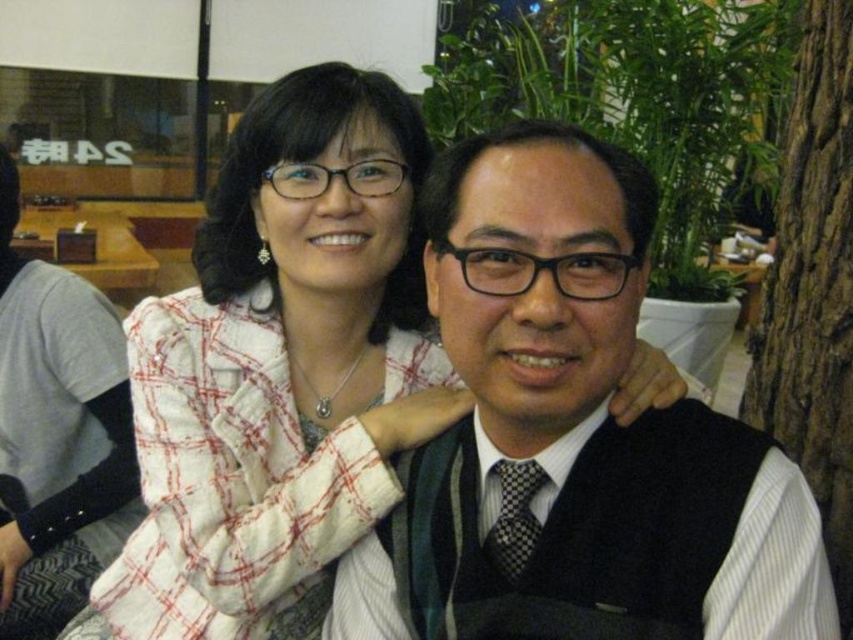
Question: Observing the image, what is the correct spatial positioning of white checkered jacket at upper center in reference to brown rough bark at right?

Choices:
 (A) above
 (B) below

Answer: (B)

Question: Estimate the real-world distances between objects in this image. Which object is closer to the matte black vest at center?

Choices:
 (A) white checkered jacket at upper center
 (B) brown rough bark at right

Answer: (A)

Question: Can you confirm if white checkered jacket at upper center is smaller than brown rough bark at right?

Choices:
 (A) no
 (B) yes

Answer: (A)

Question: Which object is the farthest from the white checkered jacket at upper center?

Choices:
 (A) brown rough bark at right
 (B) matte black vest at center

Answer: (A)

Question: Is matte black vest at center bigger than brown rough bark at right?

Choices:
 (A) no
 (B) yes

Answer: (A)

Question: Which of these objects is positioned farthest from the matte black vest at center?

Choices:
 (A) white checkered jacket at upper center
 (B) brown rough bark at right

Answer: (B)